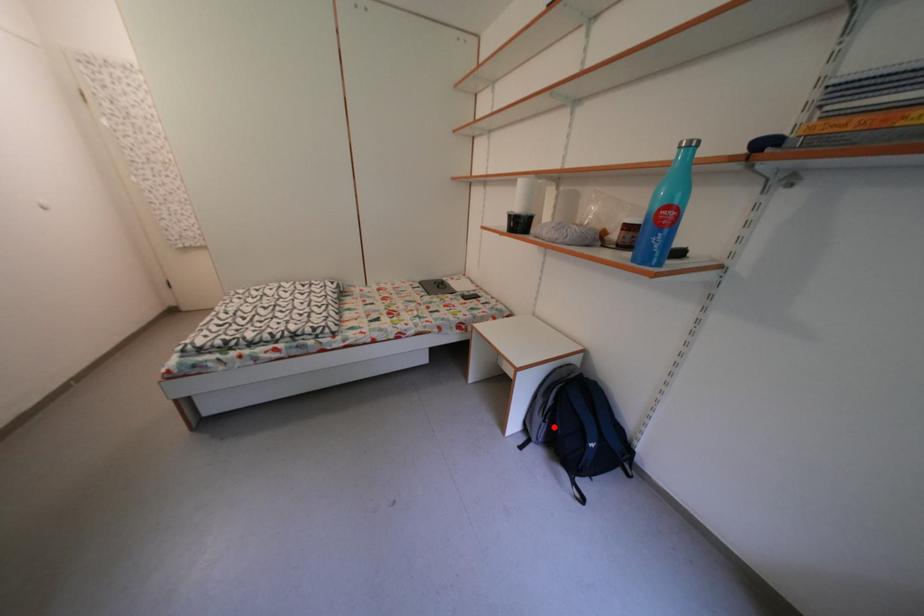
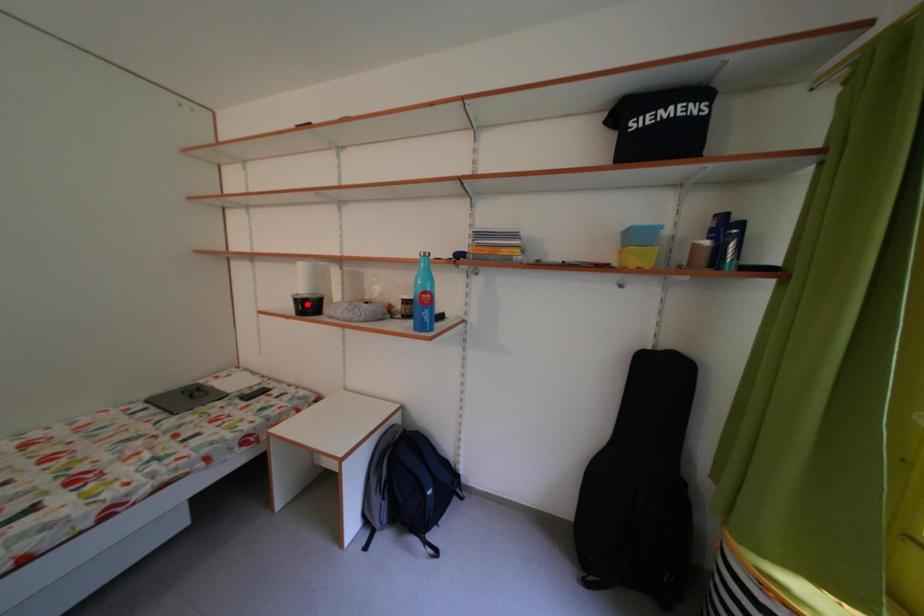
I am providing you with two images of the same scene from different viewpoints. A red point is marked on the first image and another point is marked on the second image. Are the points marked in image1 and image2 representing the same 3D position?

No